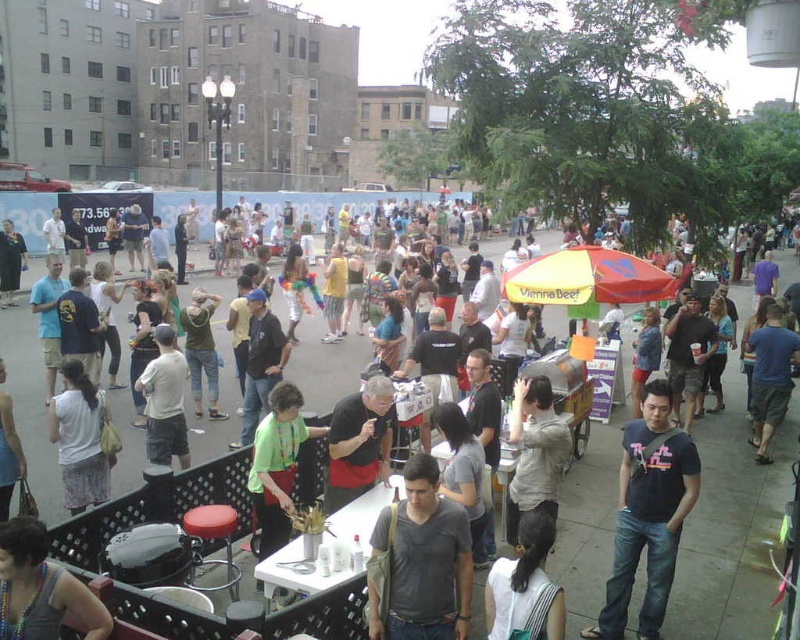
Based on the coordinates provided, can you identify which object in the scene corresponds to the point labeled as point [648,513]?

The point [648,513] corresponds to the dark blue t shirt at center.